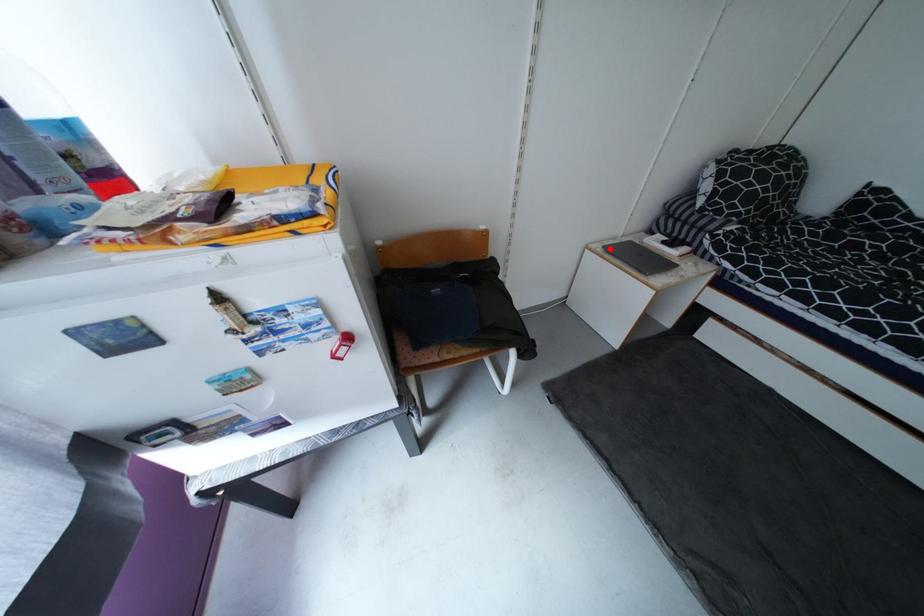
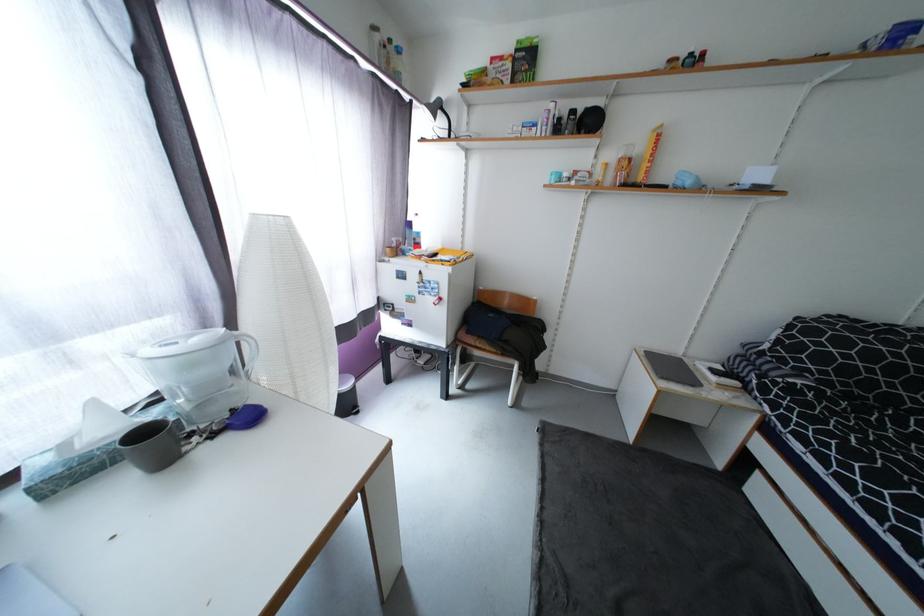
In the second image, find the point that corresponds to the highlighted location in the first image.

(650, 353)